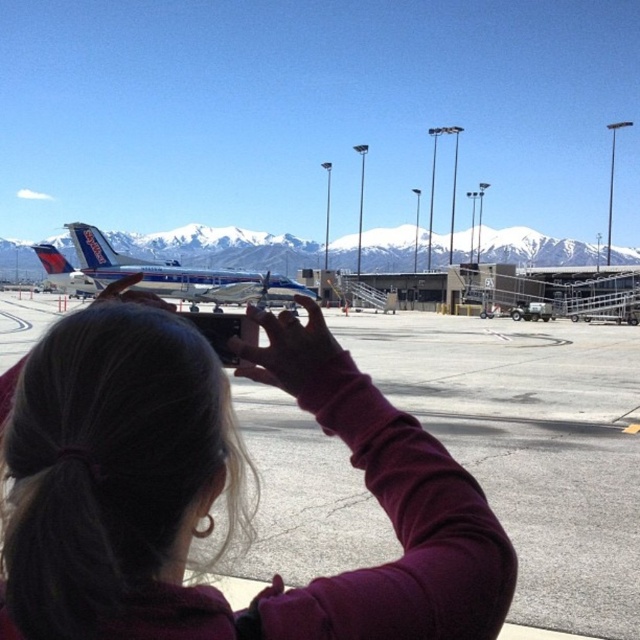
You are standing on the airport tarmac and see the snowy mountain at center and the blue metallic airplane at center. Which object is located to the left of the other?

The snowy mountain at center is positioned on the left side of blue metallic airplane at center.

You are a photographer trying to capture the snowy mountain at center and the blue metallic airplane at center in the same frame. Based on their sizes in the image, which object would appear larger in your photo?

The snowy mountain at center would appear larger in the photo because it is much taller than the blue metallic airplane at center.

You are a photographer trying to capture the blue metallic airplane at center in your shot. There is a person wearing a dark purple sweater at center blocking your view. Can you still see the airplane in your photo?

The dark purple sweater at center is in front of the blue metallic airplane at center, so the airplane may be partially or fully obscured in your photo.